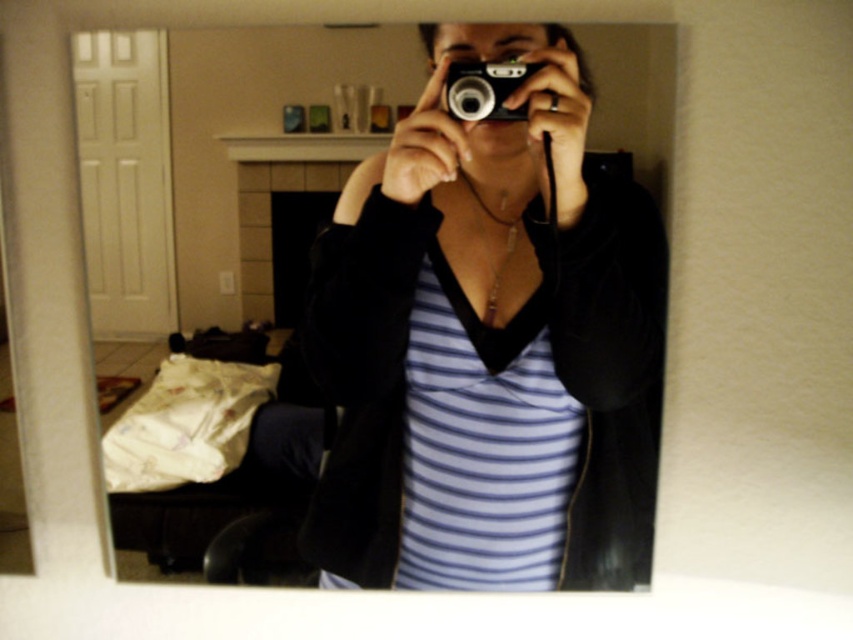
Can you confirm if matte black camera at center is shorter than silver metallic camera at center?

No.

Based on the photo, between matte black camera at center and silver metallic camera at center, which one has more height?

With more height is matte black camera at center.

Where is `matte black camera at center`? The height and width of the screenshot is (640, 853). matte black camera at center is located at coordinates (489, 346).